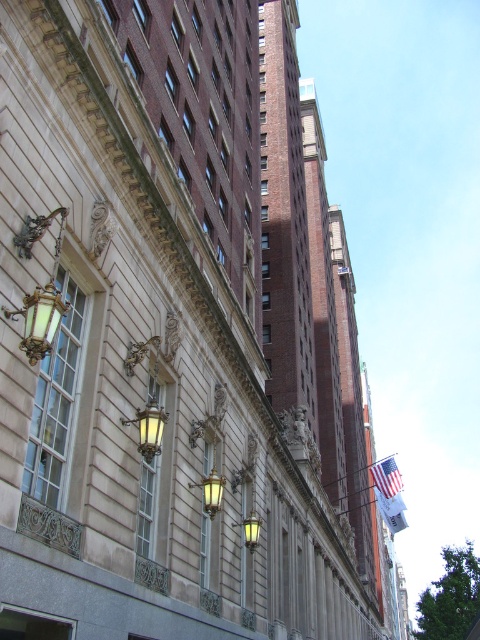
You are standing in front of the grand historic building. There is a point at coordinates (x=148, y=428). What object is located at that point?

The point at coordinates (x=148, y=428) corresponds to the matte brass lamp at center.

Consider the image. You are standing in front of the grand historic building and notice a point marked at coordinate (386, 476). What object is located at this coordinate?

The point at coordinate (386, 476) corresponds to the American flag at center.

You are a visitor standing in front of the grand historic building. You notice the american flag at center and the white fabric flag at lower right. Which flag is located more to the left?

The american flag at center is more to the left side of the white fabric flag at lower right.